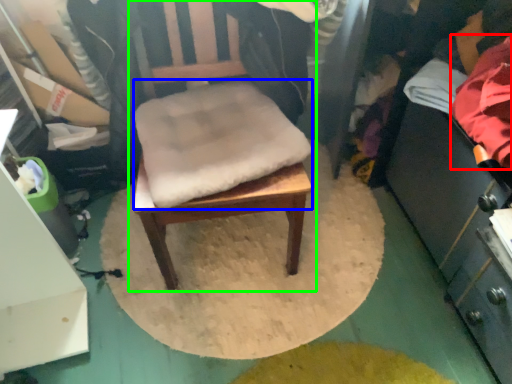
Question: Based on their relative distances, which object is farther from clothing (highlighted by a red box)? Choose from footrest (highlighted by a blue box) and chair (highlighted by a green box).

Choices:
 (A) footrest
 (B) chair

Answer: (A)